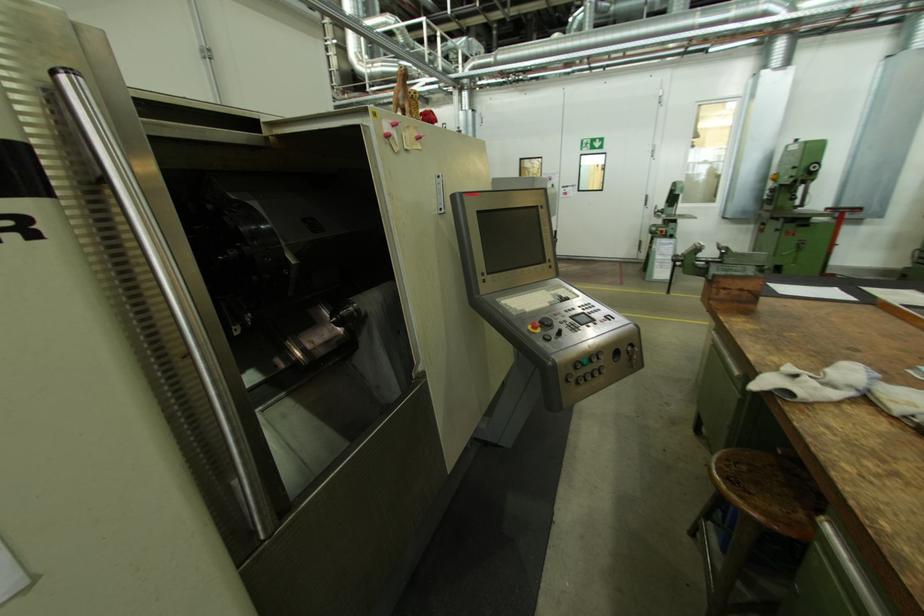
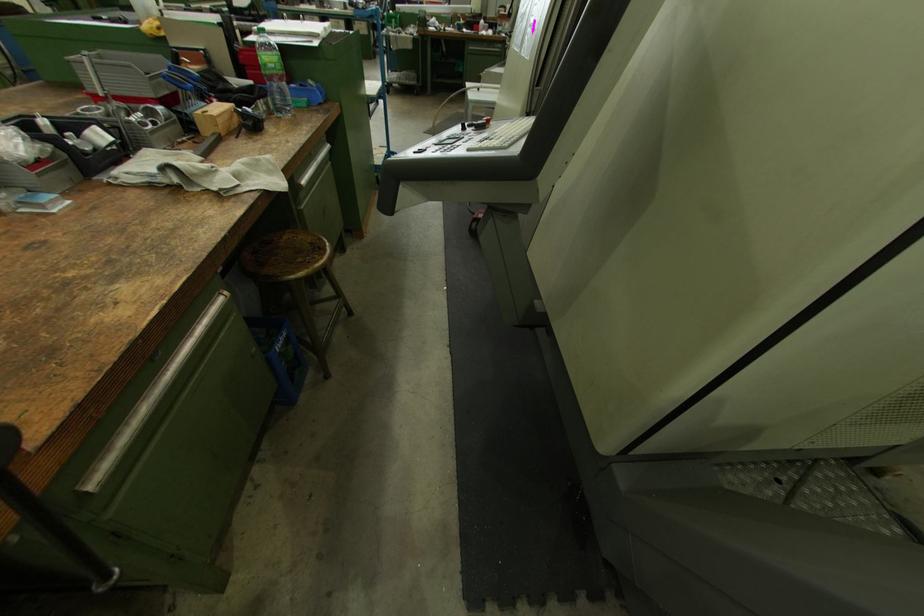
The point at (755,493) is marked in the first image. Where is the corresponding point in the second image?

(317, 244)